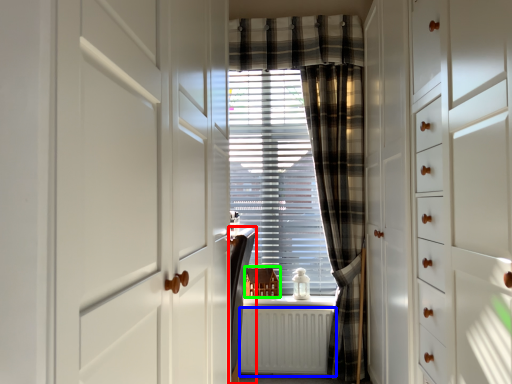
Question: Considering the real-world distances, which object is closest to furniture (highlighted by a red box)? radiator (highlighted by a blue box) or furniture (highlighted by a green box).

Choices:
 (A) radiator
 (B) furniture

Answer: (A)